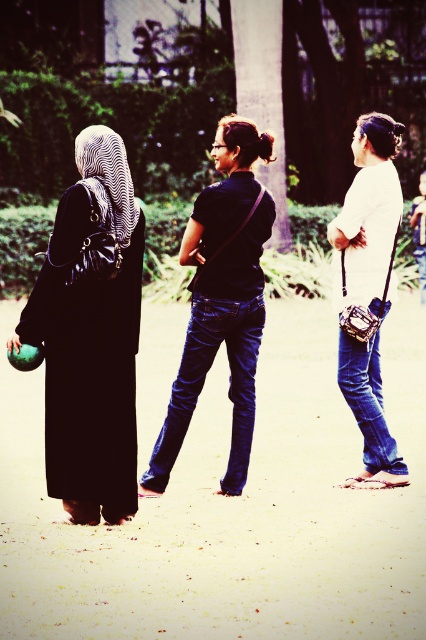
In the scene shown: Who is more distant from viewer, (x=224, y=209) or (x=115, y=170)?

The point (x=224, y=209) is more distant.

Can you confirm if black matte shirt at center is bigger than zebra-patterned fabric veil at left?

Indeed, black matte shirt at center has a larger size compared to zebra-patterned fabric veil at left.

The image size is (426, 640). I want to click on black matte shirt at center, so click(x=221, y=300).

Who is more forward, (336, 292) or (118, 138)?

Positioned in front is point (118, 138).

Is white matte camera bag at center to the left of zebra-patterned fabric veil at left from the viewer's perspective?

Incorrect, white matte camera bag at center is not on the left side of zebra-patterned fabric veil at left.

What are the coordinates of `white matte camera bag at center` in the screenshot? It's located at (x=368, y=212).

Can you confirm if matte black dress at left is positioned to the right of blue denim jeans at center?

In fact, matte black dress at left is to the left of blue denim jeans at center.

Can you confirm if matte black dress at left is thinner than blue denim jeans at center?

Correct, matte black dress at left's width is less than blue denim jeans at center's.

The image size is (426, 640). What do you see at coordinates (89, 378) in the screenshot?
I see `matte black dress at left` at bounding box center [89, 378].

Where is `matte black dress at left`? matte black dress at left is located at coordinates (89, 378).